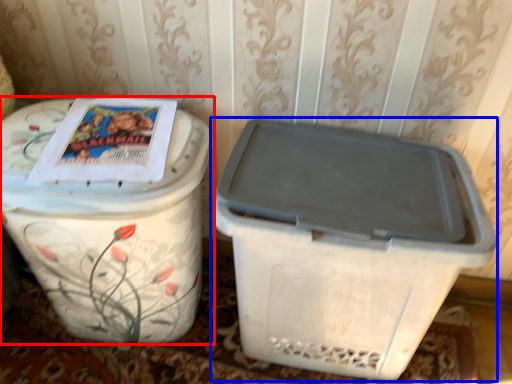
Question: Which object is further to the camera taking this photo, waste container (highlighted by a red box) or waste container (highlighted by a blue box)?

Choices:
 (A) waste container
 (B) waste container

Answer: (B)